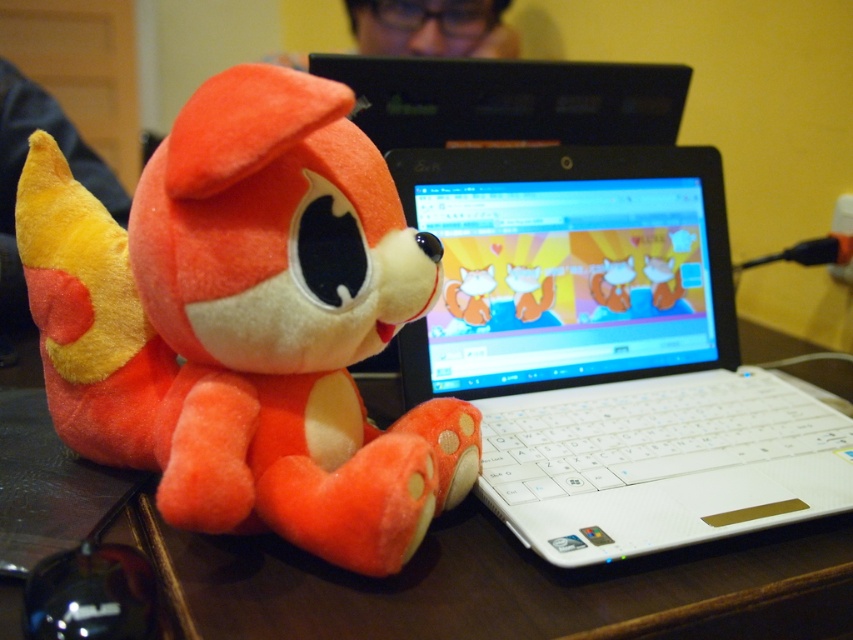
You are a photographer standing 20 inches away from the camera. You want to take a photo of the white plastic laptop at center. Can you move closer to the laptop to get a better shot?

The distance of white plastic laptop at center from camera is 18.57 inches. Since you are already 20 inches away from the camera, you cannot move closer to the laptop as it is already 18.57 inches away from the camera, which is closer than your current position.

You need to place both the white plastic laptop at center and the matte black laptop at upper center on a shelf that can only hold items up to the size of the bigger one. Which laptop should you choose to fit on the shelf?

The white plastic laptop at center is bigger than the matte black laptop at upper center, so you should choose the white plastic laptop at center to fit on the shelf since the shelf can hold items up to its size.

You are setting up a desk and need to place both the white plastic laptop at center and the matte black laptop at upper center on a shelf. The shelf has limited vertical space. Which laptop should you place first to ensure both fit vertically?

You should place the white plastic laptop at center first because it has a greater height than the matte black laptop at upper center. By placing the taller laptop first, you can ensure there is enough vertical space left for the shorter one.